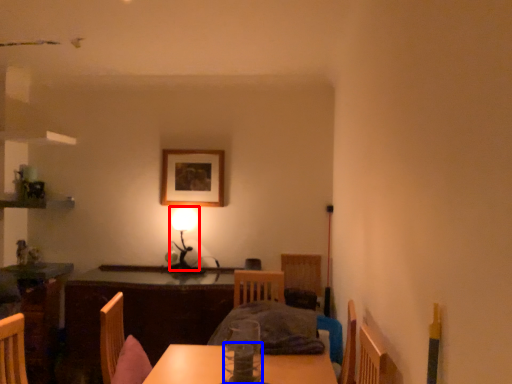
Question: Among these objects, which one is farthest to the camera, table lamp (highlighted by a red box) or tableware (highlighted by a blue box)?

Choices:
 (A) table lamp
 (B) tableware

Answer: (A)